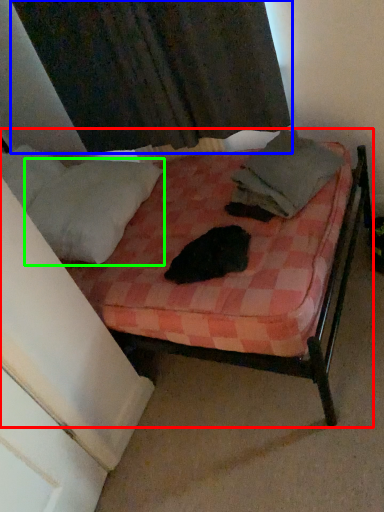
Question: Which is farther away from bed (highlighted by a red box)? curtain (highlighted by a blue box) or pillow (highlighted by a green box)?

Choices:
 (A) curtain
 (B) pillow

Answer: (A)